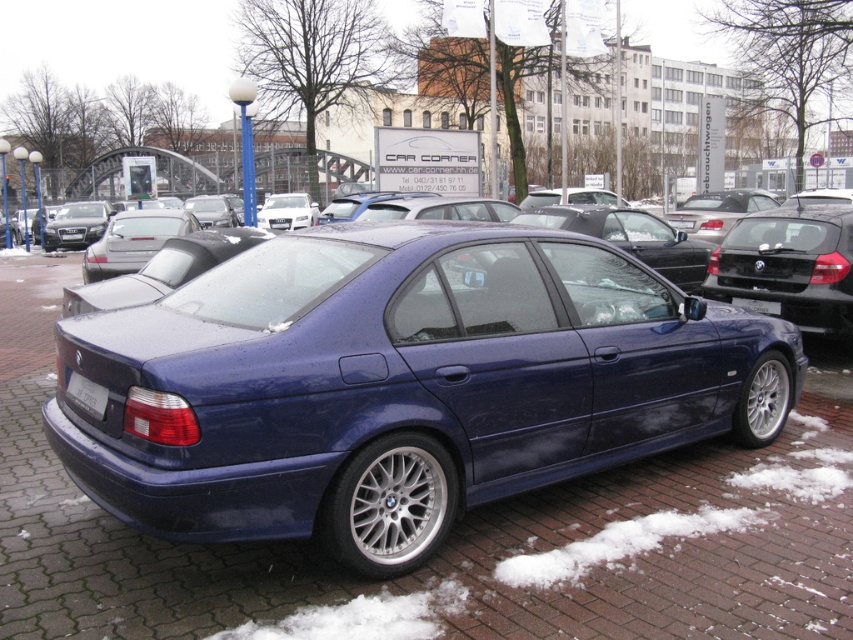
Can you confirm if blue brick pavement at center is shorter than white plastic license plate at rear?

Incorrect, blue brick pavement at center's height does not fall short of white plastic license plate at rear's.

Is point (96, 560) more distant than point (80, 404)?

That is True.

Does point (669, 627) come in front of point (99, 385)?

That is True.

At what (x,y) coordinates should I click in order to perform the action: click on blue brick pavement at center. Please return your answer as a coordinate pair (x, y). Looking at the image, I should click on (447, 538).